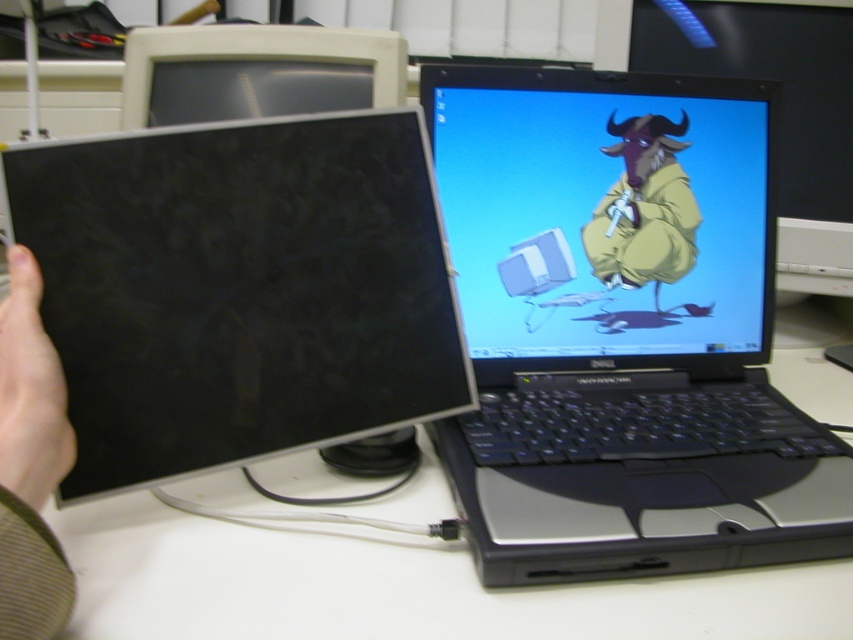
In the scene shown: Measure the distance between matte black monitor at center and camera.

A distance of 26.44 inches exists between matte black monitor at center and camera.

Is matte black monitor at center bigger than matte black monitor at left?

Correct, matte black monitor at center is larger in size than matte black monitor at left.

Measure the distance between matte black monitor at center and camera.

They are 26.44 inches apart.

Find the location of `matte black monitor at center`. matte black monitor at center is located at coordinates (606, 216).

Does white matte computer desk at center have a greater height compared to yellow matte jacket at center?

No.

Is white matte computer desk at center bigger than yellow matte jacket at center?

Correct, white matte computer desk at center is larger in size than yellow matte jacket at center.

Identify the location of white matte computer desk at center. (393, 586).

Is matte black monitor at center below white matte computer desk at center?

Actually, matte black monitor at center is above white matte computer desk at center.

Between point (479, 156) and point (737, 580), which one is positioned behind?

The point (479, 156) is behind.

Identify the location of matte black monitor at center. This screenshot has height=640, width=853. (606, 216).

Locate an element on the screen. The height and width of the screenshot is (640, 853). matte black monitor at center is located at coordinates (606, 216).